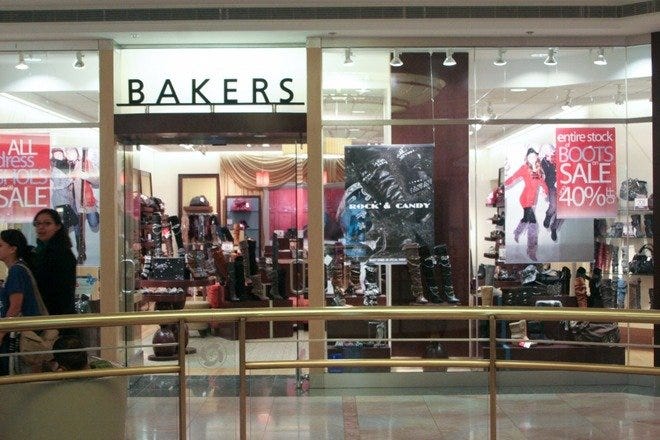
You are a GUI agent. You are given a task and a screenshot of the screen. Output one action in this format:
    pyautogui.click(x=<x>, y=<y>)
    Task: Click on the floor
    The height and width of the screenshot is (440, 660).
    Given the screenshot: What is the action you would take?
    pyautogui.click(x=389, y=424)